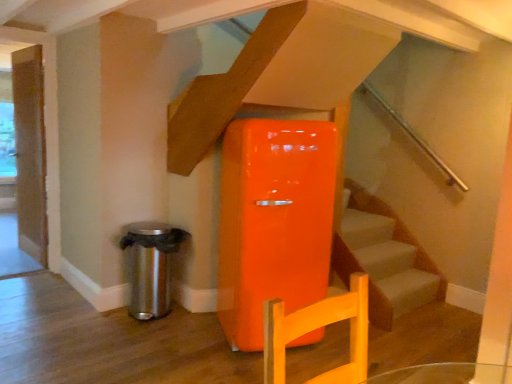
You are a GUI agent. You are given a task and a screenshot of the screen. Output one action in this format:
    pyautogui.click(x=<x>, y=<y>)
    Task: Click on the free spot to the left of polished stainless steel trash can at lower left
    Image resolution: width=512 pixels, height=384 pixels.
    Given the screenshot: What is the action you would take?
    pyautogui.click(x=89, y=314)